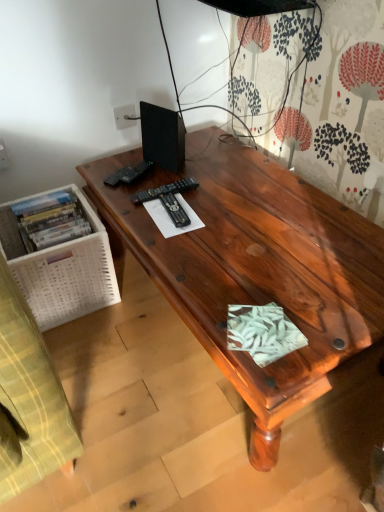
What do you see at coordinates (174, 210) in the screenshot? The image size is (384, 512). I see `black plastic remote control at center, which appears as the 1th remote control when viewed from the front` at bounding box center [174, 210].

I want to click on black matte speaker at upper left, so click(x=162, y=137).

The width and height of the screenshot is (384, 512). In order to click on black plastic remote control at center, the 2th remote control viewed from the back in this screenshot , I will do `click(164, 190)`.

Can you confirm if black plastic remote control at center, acting as the second remote control starting from the front, is positioned to the right of black matte speaker at upper left?

Yes.

From the picture: From a real-world perspective, is black plastic remote control at center, acting as the second remote control starting from the front, located beneath black matte speaker at upper left?

Correct, in the physical world, black plastic remote control at center, acting as the second remote control starting from the front, is lower than black matte speaker at upper left.

Which is more distant, (143, 194) or (156, 115)?

The point (156, 115) is farther.

Between black plastic remote control at center, acting as the second remote control starting from the front, and black matte speaker at upper left, which one has less height?

black plastic remote control at center, acting as the second remote control starting from the front.

Could you measure the distance between black plastic remote control at center, the 2th remote control viewed from the back, and black plastic remote control at center, the 3th remote control positioned from the back?

black plastic remote control at center, the 2th remote control viewed from the back, is 3.05 inches from black plastic remote control at center, the 3th remote control positioned from the back.

Is black plastic remote control at center, which appears as the 1th remote control when viewed from the front, at the back of black plastic remote control at center, the 2th remote control viewed from the back?

No, black plastic remote control at center, the 2th remote control viewed from the back, is not facing the opposite direction of black plastic remote control at center, which appears as the 1th remote control when viewed from the front.

From a real-world perspective, is black plastic remote control at center, the 2th remote control viewed from the back, physically located above or below black plastic remote control at center, which appears as the 1th remote control when viewed from the front?

black plastic remote control at center, the 2th remote control viewed from the back, is situated lower than black plastic remote control at center, which appears as the 1th remote control when viewed from the front, in the real world.

Find the location of a particular element. The image size is (384, 512). remote control that is the 2nd object to the left of the black plastic remote control at center, the 3th remote control positioned from the back, starting at the anchor is located at coordinates (127, 174).

Is black plastic remote control at center, which appears as the 1th remote control when viewed from the front, turned away from black plastic remote control at upper left, marked as the third remote control in a front-to-back arrangement?

Yes, black plastic remote control at center, which appears as the 1th remote control when viewed from the front, is positioned with its back facing black plastic remote control at upper left, marked as the third remote control in a front-to-back arrangement.

How far apart are black plastic remote control at center, the 3th remote control positioned from the back, and black plastic remote control at upper left, the first remote control in the back-to-front sequence?

black plastic remote control at center, the 3th remote control positioned from the back, and black plastic remote control at upper left, the first remote control in the back-to-front sequence, are 9.20 inches apart.

Who is bigger, black plastic remote control at center, which appears as the 1th remote control when viewed from the front, or black plastic remote control at upper left, the first remote control in the back-to-front sequence?

With larger size is black plastic remote control at center, which appears as the 1th remote control when viewed from the front.

From the picture: Considering the positions of objects black matte speaker at upper left and black plastic remote control at center, the 3th remote control positioned from the back, in the image provided, who is behind, black matte speaker at upper left or black plastic remote control at center, the 3th remote control positioned from the back,?

black matte speaker at upper left is further from the camera.

Is black matte speaker at upper left placed right next to black plastic remote control at center, which appears as the 1th remote control when viewed from the front?

No.

Is black matte speaker at upper left looking in the opposite direction of black plastic remote control at center, the 3th remote control positioned from the back?

That's not correct — black matte speaker at upper left is not looking away from black plastic remote control at center, the 3th remote control positioned from the back.

Which of these two, black matte speaker at upper left or black plastic remote control at center, acting as the second remote control starting from the front, is wider?

black plastic remote control at center, acting as the second remote control starting from the front.

How different are the orientations of black matte speaker at upper left and black plastic remote control at center, the 2th remote control viewed from the back, in degrees?

There is a 28.2-degree angle between the facing directions of black matte speaker at upper left and black plastic remote control at center, the 2th remote control viewed from the back.

From a real-world perspective, does black matte speaker at upper left stand above black plastic remote control at center, acting as the second remote control starting from the front?

Yes, from a real-world perspective, black matte speaker at upper left is on top of black plastic remote control at center, acting as the second remote control starting from the front.

Would you say black matte speaker at upper left is inside or outside black plastic remote control at center, the 2th remote control viewed from the back?

black matte speaker at upper left is located beyond the bounds of black plastic remote control at center, the 2th remote control viewed from the back.

You are a GUI agent. You are given a task and a screenshot of the screen. Output one action in this format:
    pyautogui.click(x=<x>, y=<y>)
    Task: Click on the loudspeaker that is behind the satin wood desk at center
    
    Given the screenshot: What is the action you would take?
    pyautogui.click(x=162, y=137)

Is the position of black matte speaker at upper left more distant than that of satin wood desk at center?

Yes.

From a real-world perspective, is black matte speaker at upper left beneath satin wood desk at center?

Incorrect, from a real-world perspective, black matte speaker at upper left is higher than satin wood desk at center.

Is satin wood desk at center placed right next to black plastic remote control at center, the 2th remote control viewed from the back?

They are not placed beside each other.

Between satin wood desk at center and black plastic remote control at center, the 2th remote control viewed from the back, which one has larger width?

satin wood desk at center.

Does satin wood desk at center have a greater height compared to black plastic remote control at center, the 2th remote control viewed from the back?

Indeed, satin wood desk at center has a greater height compared to black plastic remote control at center, the 2th remote control viewed from the back.

Could you tell me if satin wood desk at center is facing black plastic remote control at center, the 2th remote control viewed from the back?

No.

Locate an element on the screen. This screenshot has height=512, width=384. the 1st remote control to the right of the black matte speaker at upper left, counting from the anchor's position is located at coordinates (164, 190).

Identify the location of the 1st remote control behind when counting from the black plastic remote control at center, which appears as the 1th remote control when viewed from the front. This screenshot has height=512, width=384. tap(164, 190).

From the image, which object appears to be farther from satin wood desk at center, black matte speaker at upper left or black plastic remote control at center, the 2th remote control viewed from the back?

Among the two, black matte speaker at upper left is located further to satin wood desk at center.

Considering their positions, is black plastic remote control at center, the 2th remote control viewed from the back, positioned closer to black plastic remote control at center, which appears as the 1th remote control when viewed from the front, than satin wood desk at center?

black plastic remote control at center, the 2th remote control viewed from the back.

Looking at the image, which one is located closer to black plastic remote control at center, which appears as the 1th remote control when viewed from the front, black plastic remote control at upper left, the first remote control in the back-to-front sequence, or satin wood desk at center?

black plastic remote control at upper left, the first remote control in the back-to-front sequence, lies closer to black plastic remote control at center, which appears as the 1th remote control when viewed from the front, than the other object.

Based on their spatial positions, is black plastic remote control at upper left, marked as the third remote control in a front-to-back arrangement, or black plastic remote control at center, which appears as the 1th remote control when viewed from the front, closer to black plastic remote control at center, the 2th remote control viewed from the back?

The object closer to black plastic remote control at center, the 2th remote control viewed from the back, is black plastic remote control at center, which appears as the 1th remote control when viewed from the front.

When comparing their distances from black plastic remote control at center, the 2th remote control viewed from the back, does black matte speaker at upper left or black plastic remote control at upper left, the first remote control in the back-to-front sequence, seem closer?

The object closer to black plastic remote control at center, the 2th remote control viewed from the back, is black plastic remote control at upper left, the first remote control in the back-to-front sequence.

Based on their spatial positions, is black plastic remote control at center, the 3th remote control positioned from the back, or black plastic remote control at center, acting as the second remote control starting from the front, closer to black plastic remote control at upper left, marked as the third remote control in a front-to-back arrangement?

black plastic remote control at center, acting as the second remote control starting from the front, lies closer to black plastic remote control at upper left, marked as the third remote control in a front-to-back arrangement, than the other object.

Estimate the real-world distances between objects in this image. Which object is closer to black plastic remote control at upper left, marked as the third remote control in a front-to-back arrangement, black plastic remote control at center, acting as the second remote control starting from the front, or black matte speaker at upper left?

The object closer to black plastic remote control at upper left, marked as the third remote control in a front-to-back arrangement, is black matte speaker at upper left.

Looking at the image, which one is located closer to black plastic remote control at center, acting as the second remote control starting from the front, black plastic remote control at center, the 3th remote control positioned from the back, or black plastic remote control at upper left, marked as the third remote control in a front-to-back arrangement?

black plastic remote control at center, the 3th remote control positioned from the back, is closer to black plastic remote control at center, acting as the second remote control starting from the front.

You are a GUI agent. You are given a task and a screenshot of the screen. Output one action in this format:
    pyautogui.click(x=<x>, y=<y>)
    Task: Click on the loudspeaker positioned between satin wood desk at center and black plastic remote control at upper left, the first remote control in the back-to-front sequence, from near to far
    
    Given the screenshot: What is the action you would take?
    pyautogui.click(x=162, y=137)

At what (x,y) coordinates should I click in order to perform the action: click on remote control located between satin wood desk at center and black plastic remote control at center, the 2th remote control viewed from the back, in the depth direction. Please return your answer as a coordinate pair (x, y). Looking at the image, I should click on (174, 210).

The image size is (384, 512). I want to click on remote control between black matte speaker at upper left and black plastic remote control at center, acting as the second remote control starting from the front, vertically, so click(x=127, y=174).

The width and height of the screenshot is (384, 512). In order to click on remote control between black plastic remote control at center, which appears as the 1th remote control when viewed from the front, and black plastic remote control at upper left, the first remote control in the back-to-front sequence, along the z-axis in this screenshot , I will do `click(164, 190)`.